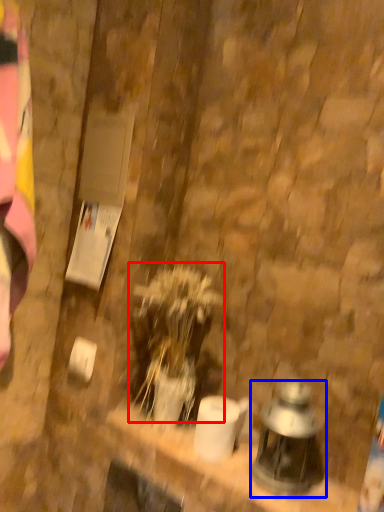
Question: Among these objects, which one is farthest to the camera, plant (highlighted by a red box) or lantern (highlighted by a blue box)?

Choices:
 (A) plant
 (B) lantern

Answer: (A)